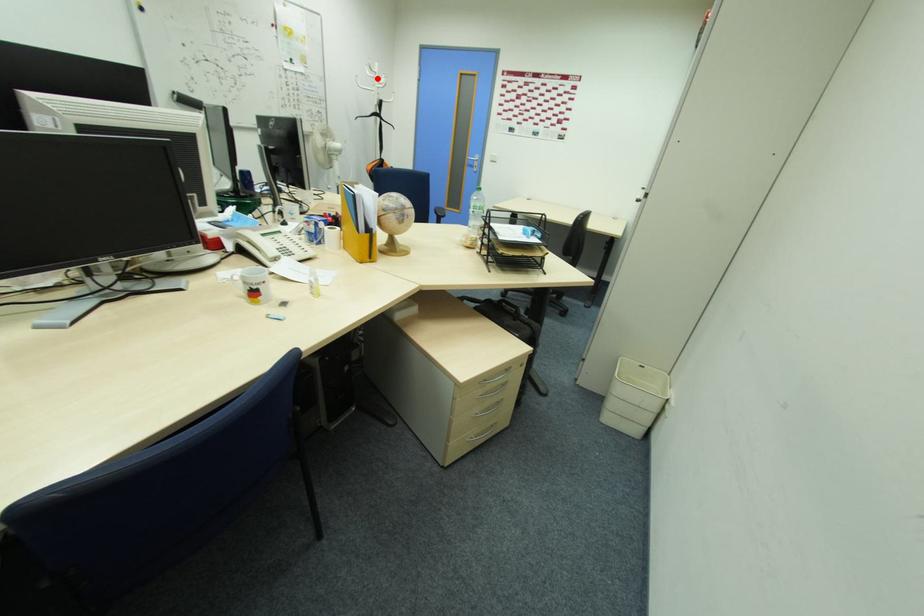
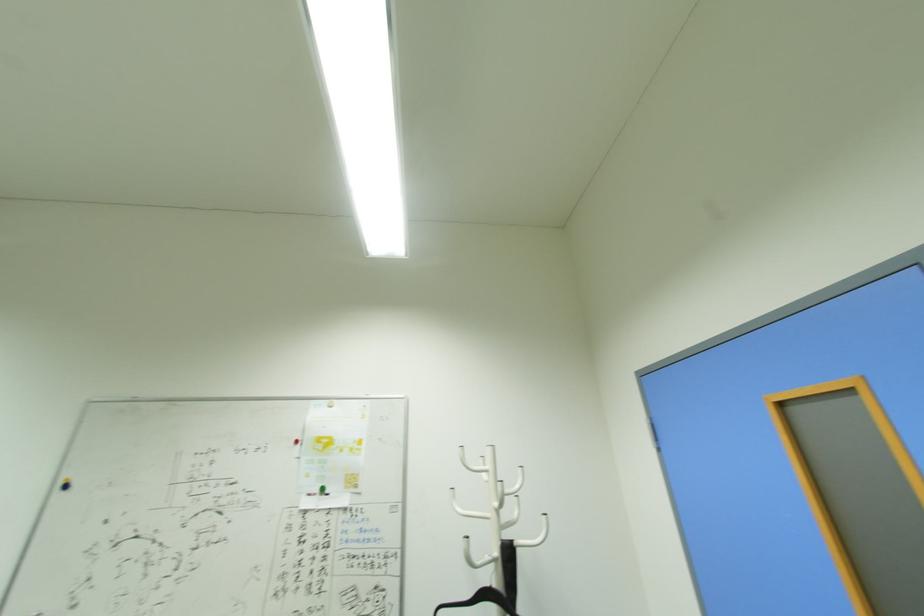
Where in the second image is the point corresponding to the highlighted location from the first image?

(492, 484)